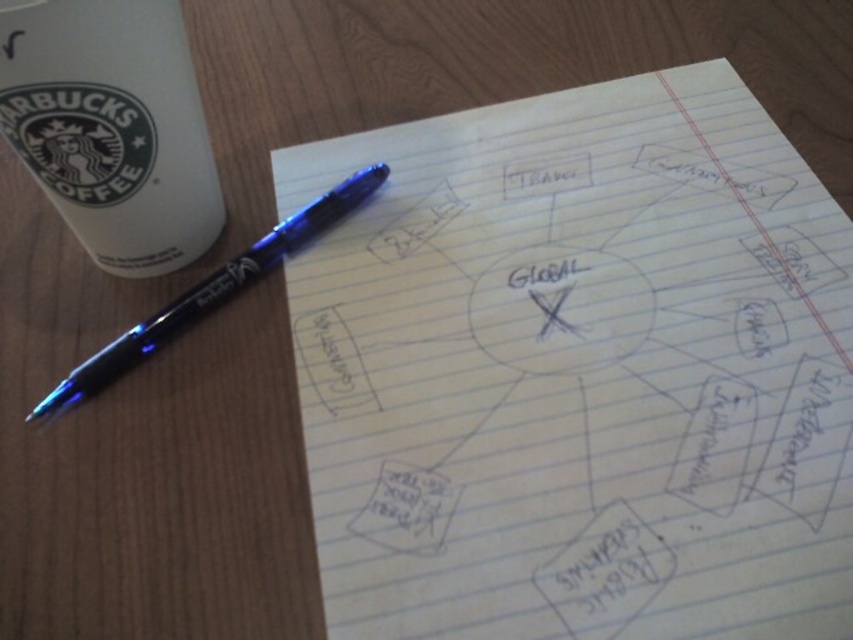
You are organizing a presentation and need to place the white lined paper at center and the blue metallic pen at upper left on a shelf. If the shelf has limited height space, which item might not fit if the height limit is 10 cm?

The white lined paper at center is much taller than the blue metallic pen at upper left. If the height limit is 10 cm, the white lined paper at center may not fit as it is taller than the pen.